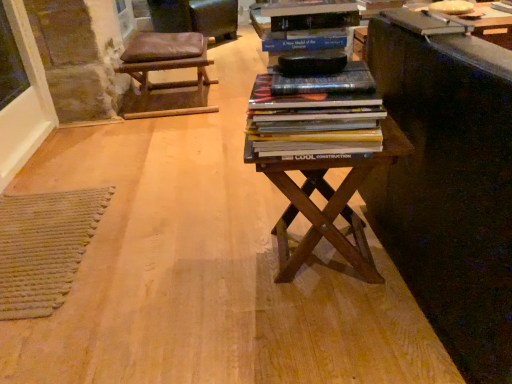
What are the coordinates of `free space in front of brown wooden table at center` in the screenshot? It's located at (320, 342).